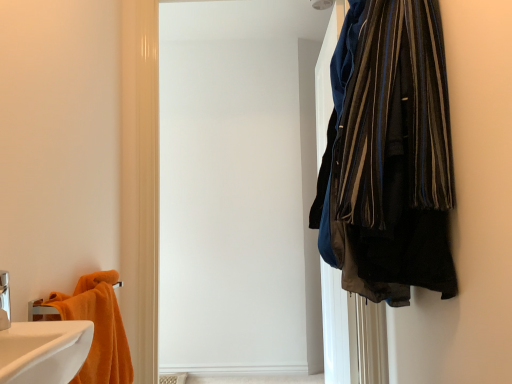
Question: Is white glossy sink at lower left spatially inside orange cotton towel at lower left, or outside of it?

Choices:
 (A) inside
 (B) outside

Answer: (B)

Question: In terms of width, does white glossy sink at lower left look wider or thinner when compared to orange cotton towel at lower left?

Choices:
 (A) thin
 (B) wide

Answer: (B)

Question: Which of these objects is positioned closest to the white matte screen door at upper right?

Choices:
 (A) orange cotton towel at lower left
 (B) white glossy sink at lower left

Answer: (A)

Question: Which object is positioned farthest from the white matte screen door at upper right?

Choices:
 (A) white glossy sink at lower left
 (B) orange cotton towel at lower left

Answer: (A)